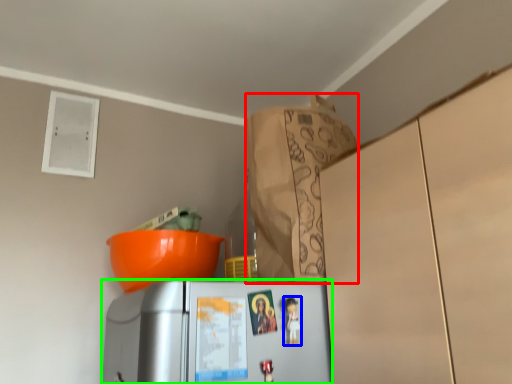
Question: Which object is the closest to the paper bag (highlighted by a red box)? Choose among these: toy (highlighted by a blue box) or refrigerator (highlighted by a green box).

Choices:
 (A) toy
 (B) refrigerator

Answer: (B)